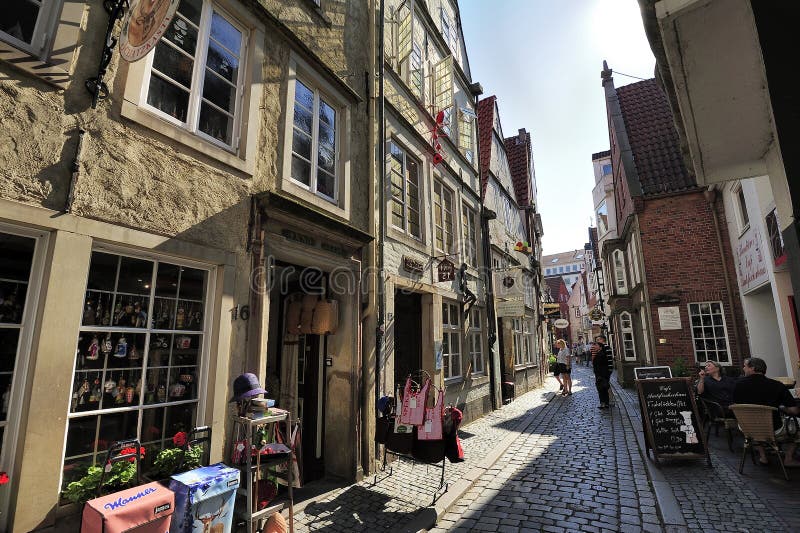
Identify the location of door. The height and width of the screenshot is (533, 800). click(306, 389).